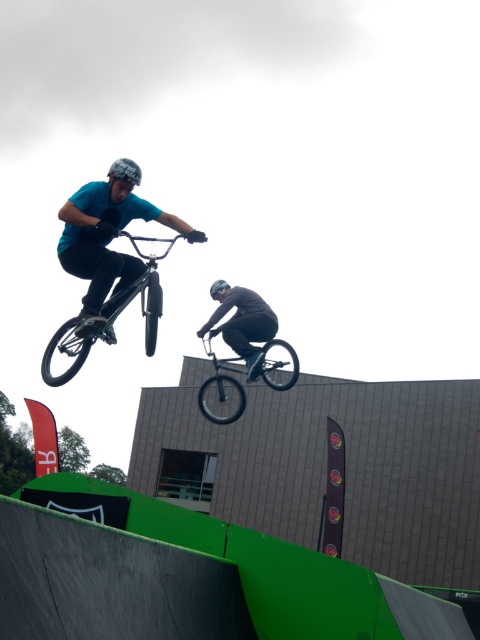
Question: Which point is farther to the camera?

Choices:
 (A) (142, 216)
 (B) (149, 316)
 (C) (250, 326)

Answer: (C)

Question: Is shiny metallic bicycle at upper center behind dark gray matte pants at center?

Choices:
 (A) no
 (B) yes

Answer: (A)

Question: Which of the following is the closest to the observer?

Choices:
 (A) (137, 275)
 (B) (51, 371)

Answer: (A)

Question: Which object is closer to the camera taking this photo?

Choices:
 (A) shiny metallic bicycle at upper center
 (B) dark gray matte pants at center
 (C) matte blue shirt at upper left
 (D) shiny black bicycle at center

Answer: (C)

Question: Is matte blue shirt at upper left thinner than shiny metallic bicycle at upper center?

Choices:
 (A) no
 (B) yes

Answer: (B)

Question: Is shiny metallic bicycle at upper center above shiny black bicycle at center?

Choices:
 (A) yes
 (B) no

Answer: (A)